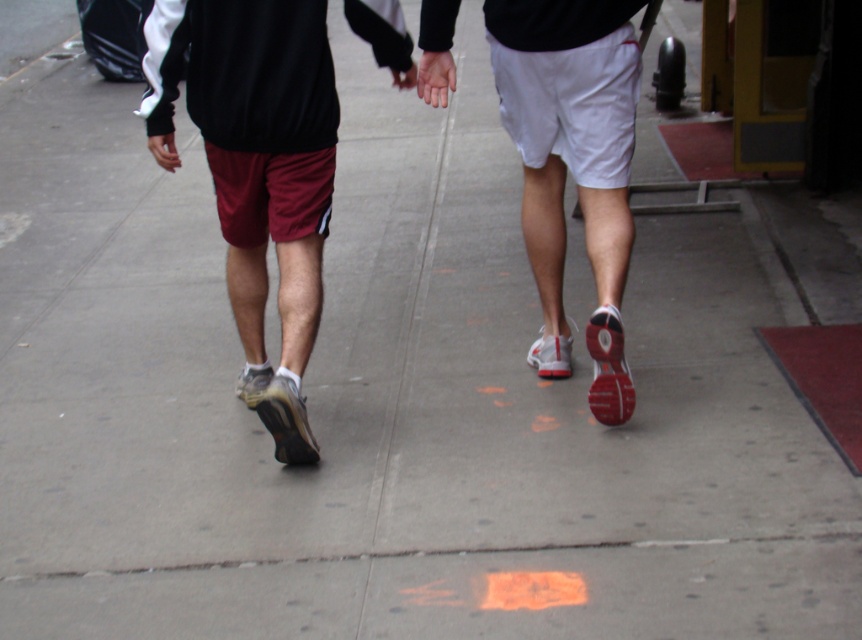
You are a photographer trying to capture a photo of the two people walking on the sidewalk. You want to ensure that both the matte black shorts at center and the white matte shorts at center are clearly visible in the photo. Based on their positions, which pair of shorts should you focus on first to ensure they are in sharp focus?

The matte black shorts at center should be focused on first because it is in front of the white matte shorts at center, making it closer to the camera and thus easier to capture in sharp focus.

You are standing on the sidewalk and see two points marked on the image. The first point is at coordinates point [572,138] and the second point is at point [431,81]. Which point is closer to you?

Point [572,138] is closer to the viewer than point [431,81].

You are a photographer trying to capture a closeup shot of the matte black shorts at center and the smooth skin hand at center in the image. Based on their sizes, which object should you zoom in on more to ensure both appear equally sized in the final photo?

The matte black shorts at center is much taller than the smooth skin hand at center, so you should zoom in more on the smooth skin hand at center to make them appear equal in size.